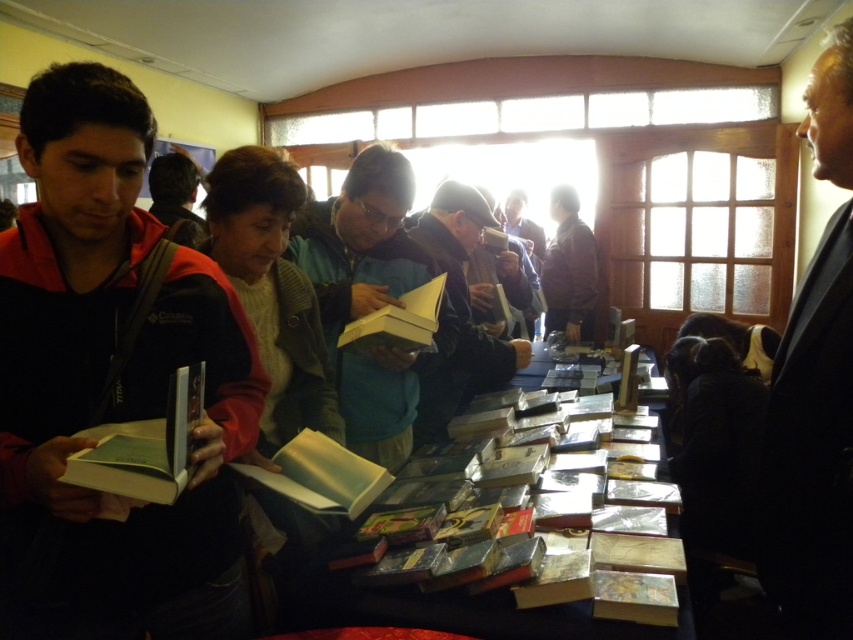
Can you confirm if shiny black table at center is positioned above yellow paper book at center?

Incorrect, shiny black table at center is not positioned above yellow paper book at center.

What are the coordinates of `shiny black table at center` in the screenshot? It's located at (456, 611).

Who is more distant from viewer, (393, 625) or (433, 300)?

The point (433, 300) is behind.

At what (x,y) coordinates should I click in order to perform the action: click on shiny black table at center. Please return your answer as a coordinate pair (x, y). Looking at the image, I should click on (456, 611).

Who is taller, shiny black table at center or dark gray fabric jacket at center?

dark gray fabric jacket at center

Does shiny black table at center appear over dark gray fabric jacket at center?

No.

Image resolution: width=853 pixels, height=640 pixels. What are the coordinates of `shiny black table at center` in the screenshot? It's located at (456, 611).

How far apart are black suit at right and shiny black table at center?

They are 21.69 inches apart.

Is black suit at right smaller than shiny black table at center?

No.

Image resolution: width=853 pixels, height=640 pixels. Describe the element at coordinates (811, 448) in the screenshot. I see `black suit at right` at that location.

This screenshot has height=640, width=853. I want to click on black suit at right, so click(x=811, y=448).